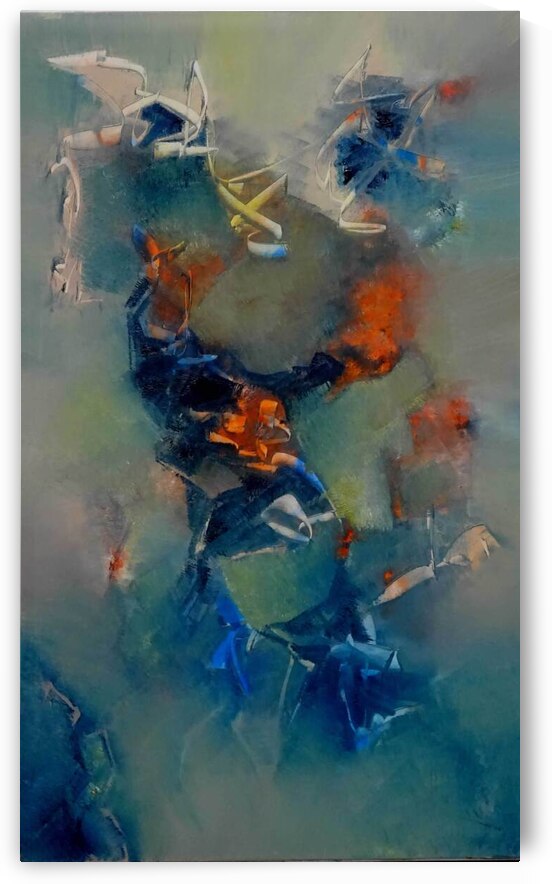
You are a GUI agent. You are given a task and a screenshot of the screen. Output one action in this format:
    pyautogui.click(x=<x>, y=<y>)
    Task: Click on the white background behind picture
    Image resolution: width=552 pixels, height=884 pixels.
    Given the screenshot: What is the action you would take?
    tap(13, 124), tap(14, 650), tap(15, 704), tap(525, 684)